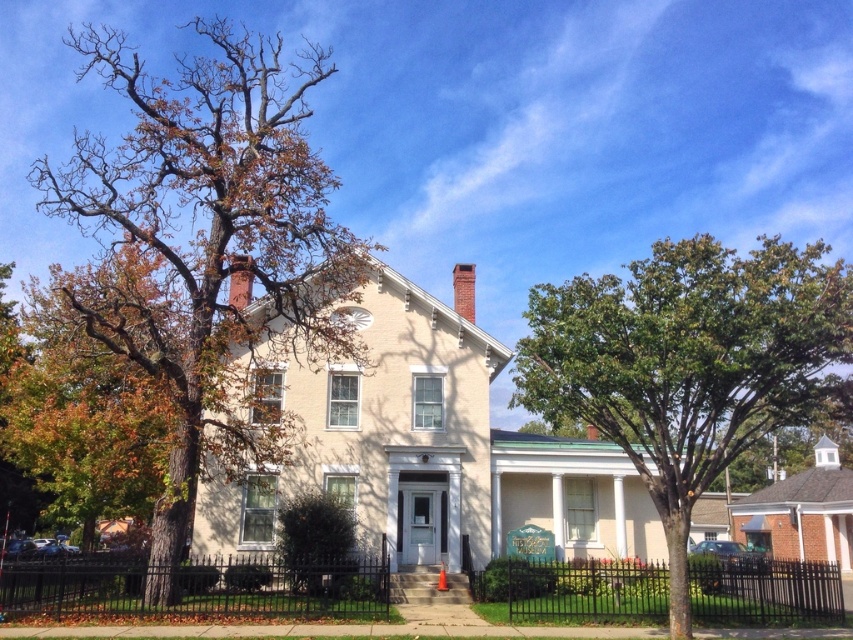
Who is more forward, (341, 602) or (460, 266)?

Positioned in front is point (341, 602).

Based on the photo, can you confirm if black wrought iron fence at lower left is smaller than brick chimney at upper center?

Incorrect, black wrought iron fence at lower left is not smaller in size than brick chimney at upper center.

Locate an element on the screen. The height and width of the screenshot is (640, 853). black wrought iron fence at lower left is located at coordinates (192, 586).

Who is more forward, (310, 285) or (727, 580)?

Point (727, 580)

Find the location of a particular element. The image size is (853, 640). brown leafy tree at left is located at coordinates (207, 250).

Is point (701, 586) behind point (233, 296)?

No, it is not.

Is point (805, 586) farther from viewer compared to point (241, 300)?

No.

Image resolution: width=853 pixels, height=640 pixels. I want to click on black wrought iron fence at lower center, so click(576, 589).